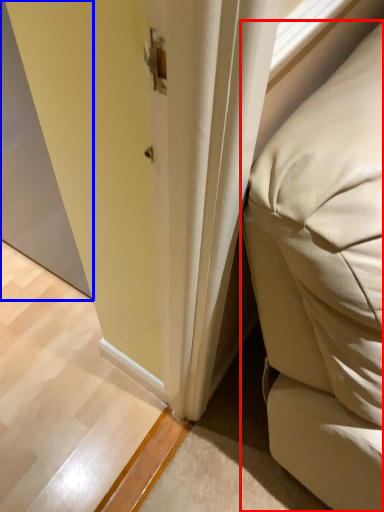
Question: Which object is further to the camera taking this photo, furniture (highlighted by a red box) or screen door (highlighted by a blue box)?

Choices:
 (A) furniture
 (B) screen door

Answer: (B)